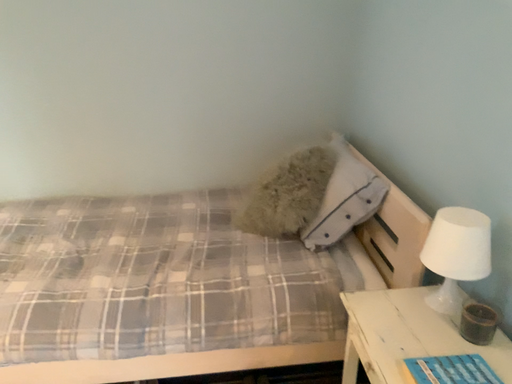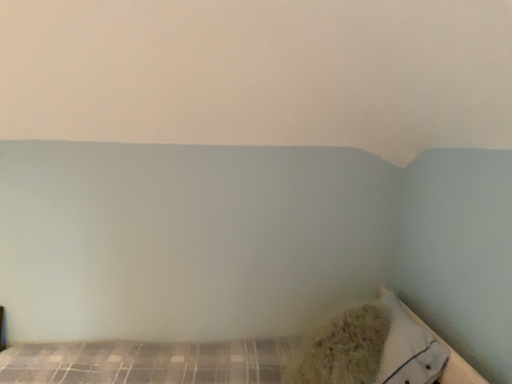
Question: Which way did the camera rotate in the video?

Choices:
 (A) rotated upward
 (B) rotated downward

Answer: (A)